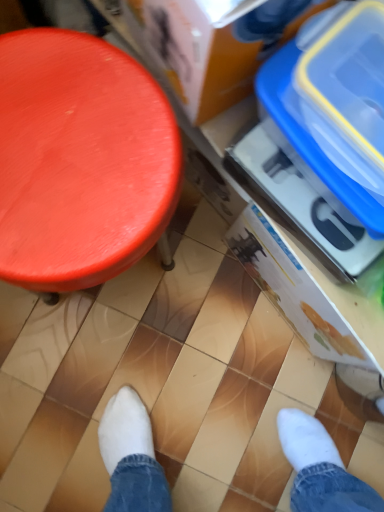
Question: Is blue plastic storage box at right, which is the 1th storage box from back to front, not close to smooth orange stool at left?

Choices:
 (A) yes
 (B) no

Answer: (B)

Question: Is smooth orange stool at left at the back of blue plastic storage box at right, the third storage box viewed from the front?

Choices:
 (A) yes
 (B) no

Answer: (B)

Question: Does blue plastic storage box at right, which is the 1th storage box from back to front, have a larger size compared to smooth orange stool at left?

Choices:
 (A) yes
 (B) no

Answer: (B)

Question: Is blue plastic storage box at right, which is the 1th storage box from back to front, facing towards smooth orange stool at left?

Choices:
 (A) yes
 (B) no

Answer: (B)

Question: Considering the relative sizes of blue plastic storage box at right, which is the 1th storage box from back to front, and smooth orange stool at left in the image provided, is blue plastic storage box at right, which is the 1th storage box from back to front, wider than smooth orange stool at left?

Choices:
 (A) no
 (B) yes

Answer: (A)

Question: Is blue plastic storage box at right, which is the 1th storage box from back to front, surrounding smooth orange stool at left?

Choices:
 (A) yes
 (B) no

Answer: (B)

Question: Could you tell me if blue plastic storage box at upper right, positioned as the 1th storage box in front-to-back order, is facing blue plastic storage box at upper right, the 2th storage box positioned from the front?

Choices:
 (A) yes
 (B) no

Answer: (A)

Question: Are blue plastic storage box at upper right, the third storage box viewed from the back, and blue plastic storage box at upper right, the 2th storage box positioned from the front, beside each other?

Choices:
 (A) yes
 (B) no

Answer: (A)

Question: From the image's perspective, is blue plastic storage box at upper right, positioned as the 1th storage box in front-to-back order, under blue plastic storage box at upper right, the 2th storage box positioned from the front?

Choices:
 (A) no
 (B) yes

Answer: (A)

Question: Can you confirm if blue plastic storage box at upper right, the third storage box viewed from the back, is taller than blue plastic storage box at upper right, the 2th storage box viewed from the back?

Choices:
 (A) no
 (B) yes

Answer: (B)

Question: Is blue plastic storage box at upper right, the third storage box viewed from the back, positioned with its back to blue plastic storage box at upper right, the 2th storage box viewed from the back?

Choices:
 (A) no
 (B) yes

Answer: (A)

Question: Considering the relative sizes of blue plastic storage box at upper right, positioned as the 1th storage box in front-to-back order, and blue plastic storage box at upper right, the 2th storage box viewed from the back, in the image provided, is blue plastic storage box at upper right, positioned as the 1th storage box in front-to-back order, shorter than blue plastic storage box at upper right, the 2th storage box viewed from the back,?

Choices:
 (A) no
 (B) yes

Answer: (A)

Question: Is blue plastic storage box at upper right, the 2th storage box viewed from the back, bigger than smooth orange stool at left?

Choices:
 (A) yes
 (B) no

Answer: (B)